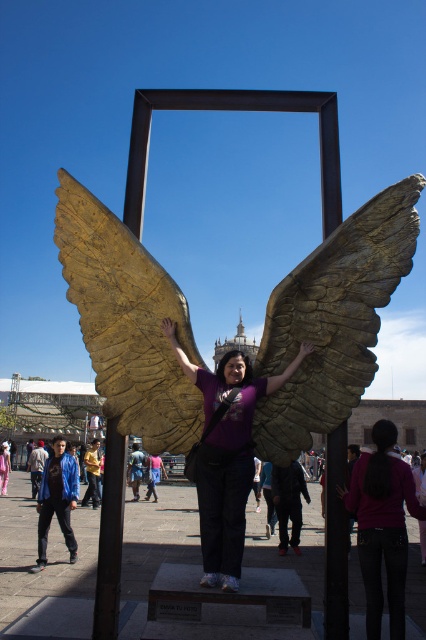
Question: Does blue denim jeans at center appear under matte purple shirt at center?

Choices:
 (A) yes
 (B) no

Answer: (B)

Question: Which of the following is the closest to the observer?

Choices:
 (A) blue denim jeans at center
 (B) purple matte shirt at center
 (C) dark purple shirt at center

Answer: (B)

Question: Among these objects, which one is farthest from the camera?

Choices:
 (A) matte purple shirt at center
 (B) dark purple shirt at center
 (C) gold textured wings at center
 (D) blue denim jeans at center

Answer: (D)

Question: Can you confirm if purple matte shirt at center is smaller than dark purple shirt at center?

Choices:
 (A) yes
 (B) no

Answer: (A)

Question: Is dark purple shirt at center wider than blue denim jeans at center?

Choices:
 (A) yes
 (B) no

Answer: (A)

Question: Among these points, which one is nearest to the camera?

Choices:
 (A) (157, 458)
 (B) (132, 456)

Answer: (B)